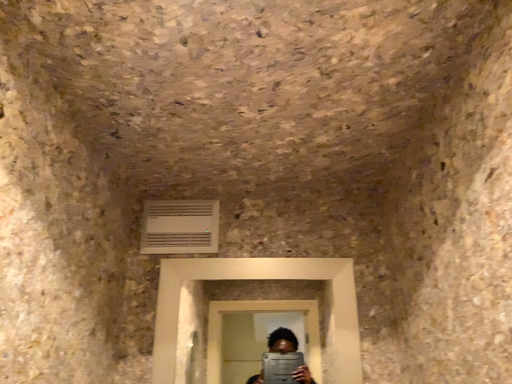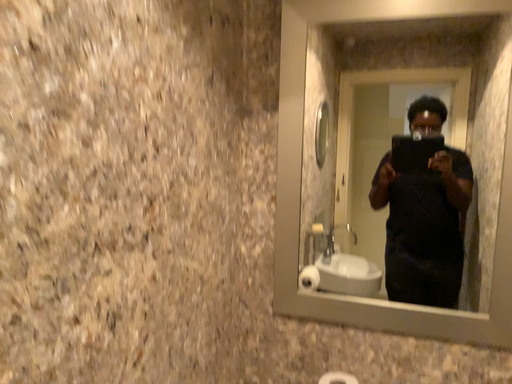
Question: How did the camera likely rotate when shooting the video?

Choices:
 (A) rotated upward
 (B) rotated downward

Answer: (B)